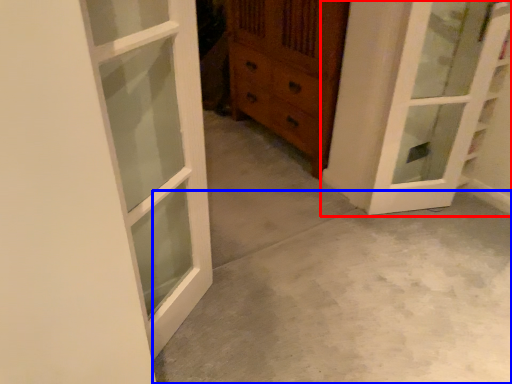
Question: Which point is closer to the camera, door (highlighted by a red box) or concrete (highlighted by a blue box)?

Choices:
 (A) door
 (B) concrete

Answer: (B)